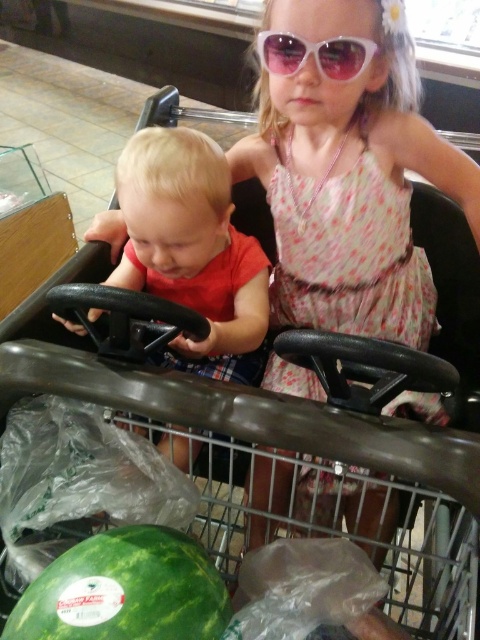
How much distance is there between matte black steering wheel at left and green matte watermelon at lower left?

A distance of 37.24 centimeters exists between matte black steering wheel at left and green matte watermelon at lower left.

In the scene shown: Is the position of matte black steering wheel at left more distant than that of green matte watermelon at lower left?

That is True.

Between point (216, 262) and point (163, 564), which one is positioned in front?

Point (163, 564) is more forward.

I want to click on matte black steering wheel at left, so click(x=192, y=250).

Does green matte watermelon at lower left have a greater width compared to white plastic goggles at upper center?

Yes, green matte watermelon at lower left is wider than white plastic goggles at upper center.

Does point (82, 586) come in front of point (262, 32)?

Yes, point (82, 586) is closer to viewer.

Identify the location of green matte watermelon at lower left. The width and height of the screenshot is (480, 640). (124, 589).

Who is more distant from viewer, (162, 236) or (280, 56)?

The point (280, 56) is more distant.

Is matte black steering wheel at left smaller than white plastic goggles at upper center?

Incorrect, matte black steering wheel at left is not smaller in size than white plastic goggles at upper center.

Is point (181, 156) positioned behind point (325, 58)?

No, (181, 156) is in front of (325, 58).

The image size is (480, 640). Find the location of `matte black steering wheel at left`. matte black steering wheel at left is located at coordinates (192, 250).